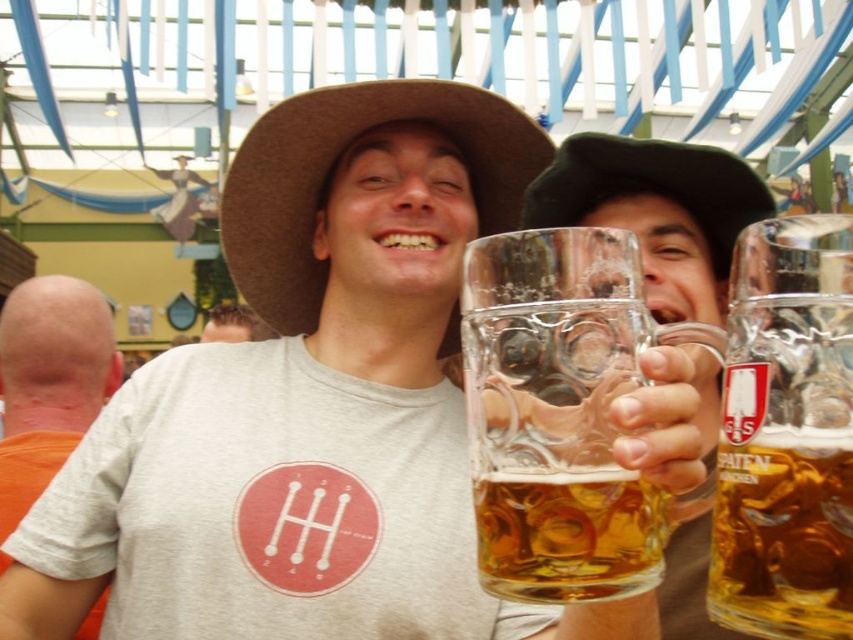
Question: Which object is farther from the camera taking this photo?

Choices:
 (A) brown felt cowboy hat at center
 (B) clear glass mug at right

Answer: (A)

Question: Is clear glass mug at right smaller than orange fabric at left?

Choices:
 (A) yes
 (B) no

Answer: (A)

Question: Which of the following is the farthest from the observer?

Choices:
 (A) clear glass mug at upper center
 (B) brown felt cowboy hat at center

Answer: (B)

Question: Is clear glass mug at upper center bigger than clear glass mug at right?

Choices:
 (A) no
 (B) yes

Answer: (B)

Question: Estimate the real-world distances between objects in this image. Which object is farther from the black felt hat at upper right?

Choices:
 (A) orange fabric at left
 (B) clear glass mug at center
 (C) clear glass mug at upper center

Answer: (A)

Question: Does brown felt cowboy hat at center come in front of matte gray t-shirt at center?

Choices:
 (A) yes
 (B) no

Answer: (A)